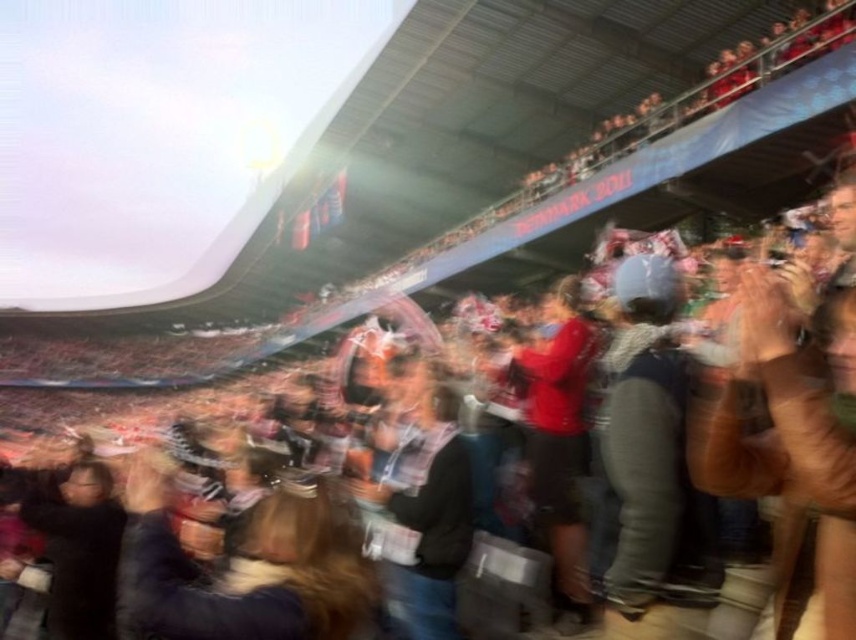
You are a photographer at the stadium and want to capture a photo of the dark brown leather jacket at center without the dark gray fabric crowd at center blocking it. Based on their positions, is this possible?

The dark brown leather jacket at center is positioned on the left side of the dark gray fabric crowd at center, so it is possible to capture the jacket without the crowd blocking it by framing the shot to the left side.

You are a photographer trying to capture a clear shot of the dark brown leather jacket at center. Given the motion blur in the image, where should you focus your camera to ensure the jacket is sharp?

You should focus your camera at point (247, 564) to ensure the dark brown leather jacket at center is sharp.

You are a drone operator trying to capture a clear aerial shot of the dark gray sweater at center and the dark gray fabric crowd at center during the sports event. Given that your drone camera has a maximum focus range of 35 feet, will you be able to capture both subjects clearly?

The dark gray sweater at center is 37.94 feet away from dark gray fabric crowd at center. Since the drone camera can only focus up to 35 feet, it cannot capture both subjects clearly as they are beyond the maximum focus range.